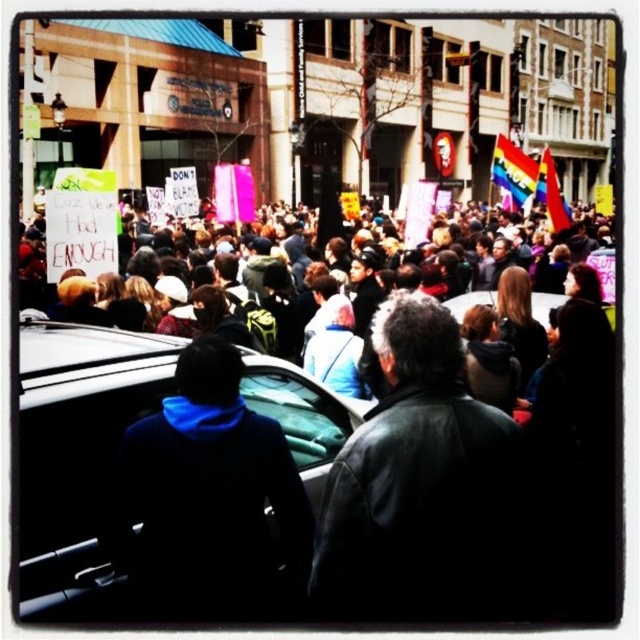
You are a photographer positioned at the edge of the protest crowd. You need to capture a photo that includes both the black matte car at center and the black leather jacket at center. Given that your camera has a fixed focal length, which object should you position closer to the center of the frame to ensure both are fully visible without cropping?

Since the black matte car at center is wider than the black leather jacket at center, you should position the black leather jacket at center closer to the center of the frame. This way, the wider car can occupy more space while still keeping both objects within the frame.

You are a delivery driver who needs to park your car at the black matte car at center. The parking space is 30 meters long. Can you safely park your car there?

The black matte car at center is 28.44 meters away from the camera, so yes, the parking space is long enough to accommodate the car since 28.44 meters is less than 30 meters.

You are a protest organizer trying to ensure safety during the event. You notice two individuals at coordinates point (x=449, y=269). Based on their distance, can you estimate if they are within a safe social distancing range of 2 meters?

The two individuals at point (x=449, y=269) are 68.01 meters apart, which is well beyond the 2 meter safe social distancing requirement. They are not in close proximity to each other.